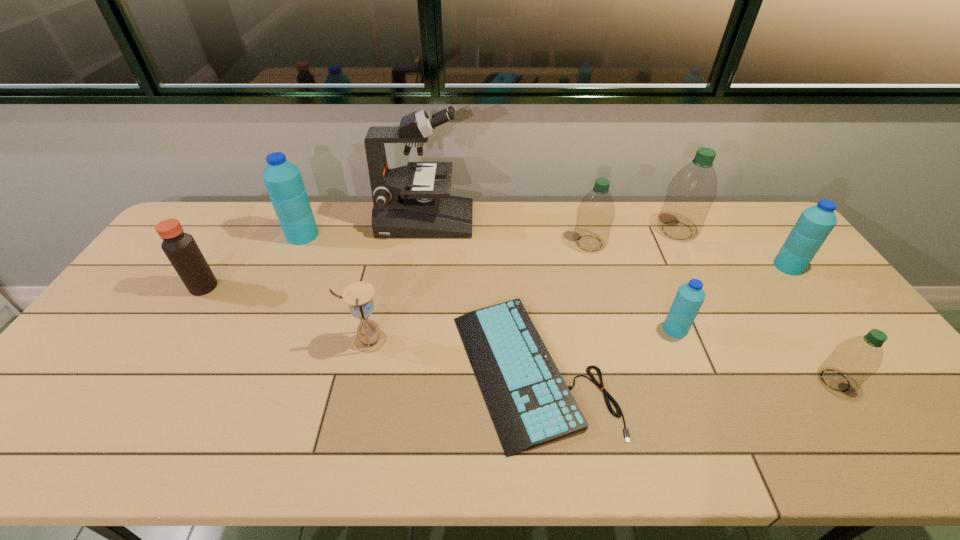
Where is `free spot located 0.090m on the front of the leftmost water bottle`? Image resolution: width=960 pixels, height=540 pixels. free spot located 0.090m on the front of the leftmost water bottle is located at coordinates (289, 264).

Find the location of a particular element. The height and width of the screenshot is (540, 960). free location located 0.200m on the right of the leftmost green water bottle is located at coordinates (666, 243).

Where is `vacant space located on the left of the fifth farthest object`? Image resolution: width=960 pixels, height=540 pixels. vacant space located on the left of the fifth farthest object is located at coordinates (661, 266).

Identify the location of vacant space located on the front of the brown vinegar. Image resolution: width=960 pixels, height=540 pixels. (175, 334).

What are the coordinates of `free location located 0.060m on the left of the white hourglass` in the screenshot? It's located at point(325,341).

At what (x,y) coordinates should I click in order to perform the action: click on vacant area situated 0.310m on the back of the nearest green water bottle. Please return your answer as a coordinate pair (x, y). This screenshot has width=960, height=540. Looking at the image, I should click on (769, 281).

Locate an element on the screen. Image resolution: width=960 pixels, height=540 pixels. free space located on the right of the second blue water bottle from left to right is located at coordinates point(818,329).

This screenshot has width=960, height=540. Identify the location of vacant space positioned 0.300m on the back of the shortest object. (518, 239).

Locate an element on the screen. This screenshot has height=540, width=960. microscope that is at the far edge is located at coordinates (408, 203).

Locate an element on the screen. This screenshot has height=540, width=960. object that is at the near edge is located at coordinates (530, 404).